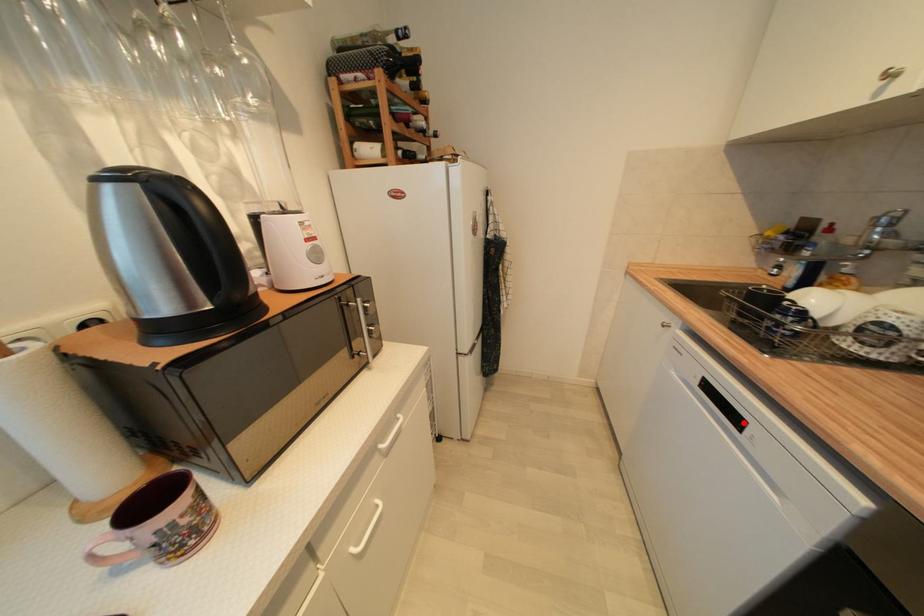
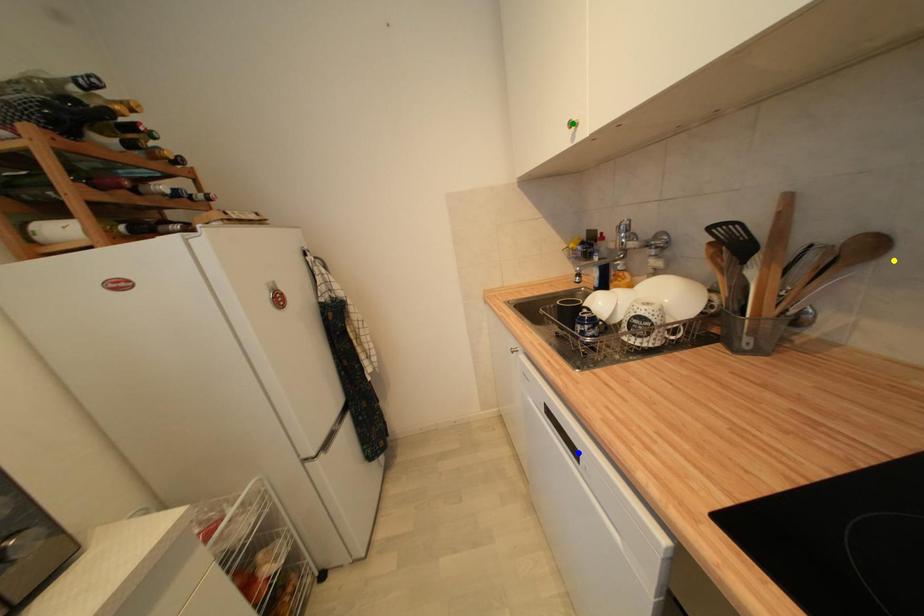
Question: I am providing you with two images of the same scene from different viewpoints. A red point is marked on the first image. You are given multiple points on the second image. In image 2, which mark is for the same physical point as the one in image 1?

Choices:
 (A) blue point
 (B) green point
 (C) yellow point

Answer: (A)